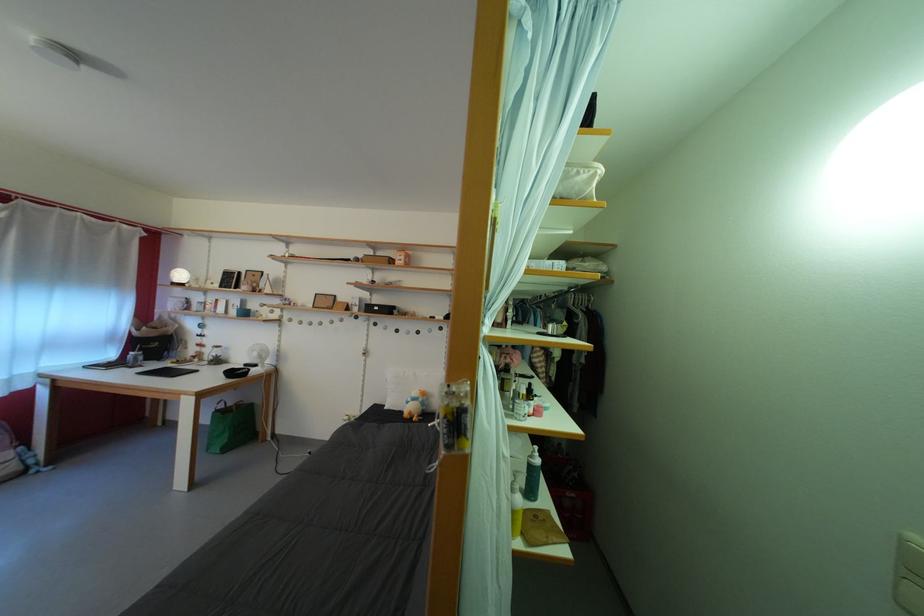
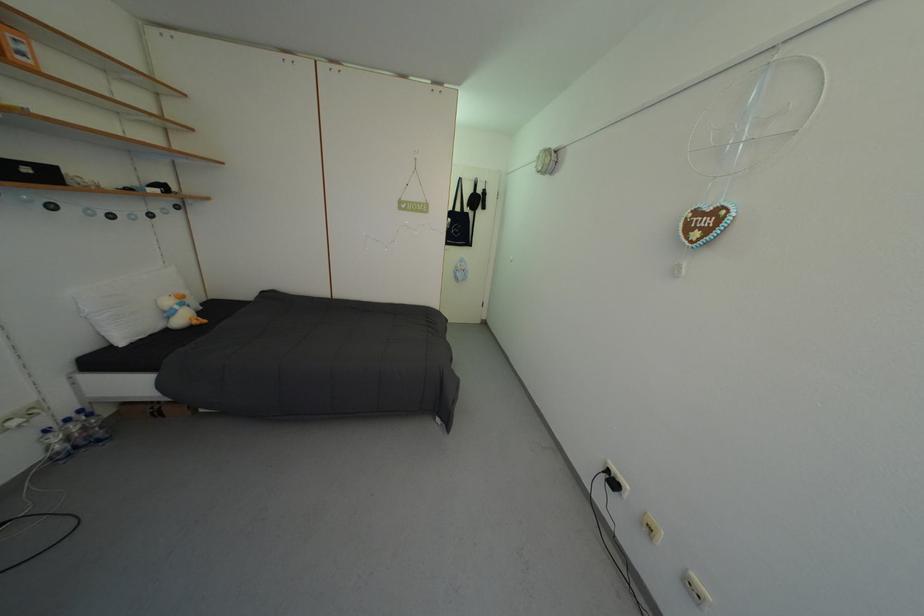
In the second image, find the point that corresponds to (384,314) in the first image.

(35, 176)